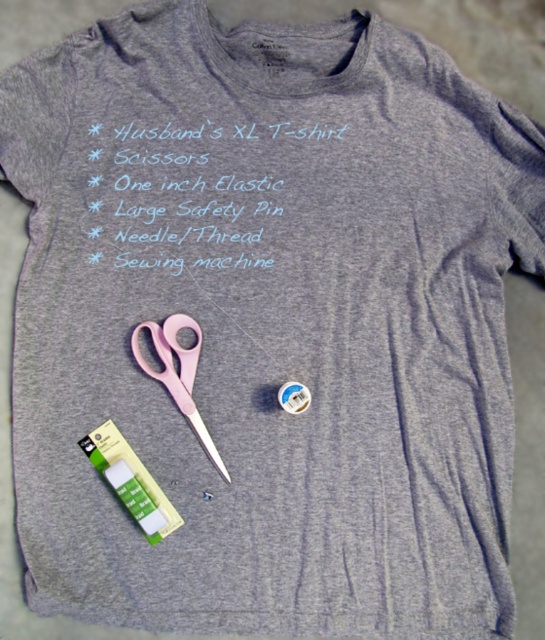
Question: Among these objects, which one is nearest to the camera?

Choices:
 (A) pink plastic scissors at lower left
 (B) gray fabric husband's xl t-shirt at upper center

Answer: (B)

Question: Does gray fabric husband's xl t-shirt at upper center appear under pink plastic scissors at lower left?

Choices:
 (A) yes
 (B) no

Answer: (B)

Question: Is gray fabric husband's xl t-shirt at upper center thinner than pink plastic scissors at lower left?

Choices:
 (A) no
 (B) yes

Answer: (A)

Question: In this image, where is gray fabric husband's xl t-shirt at upper center located relative to pink plastic scissors at lower left?

Choices:
 (A) right
 (B) left

Answer: (A)